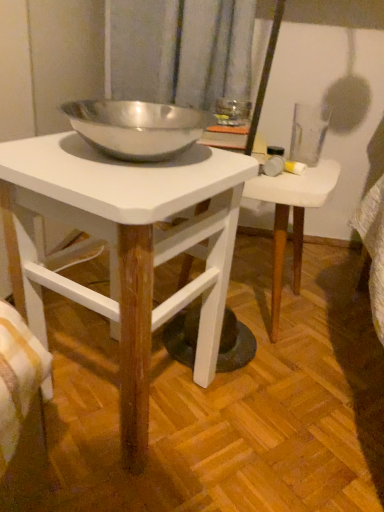
This screenshot has width=384, height=512. I want to click on free location to the right of white wood table at center, which is the first table in back-to-front order, so click(339, 313).